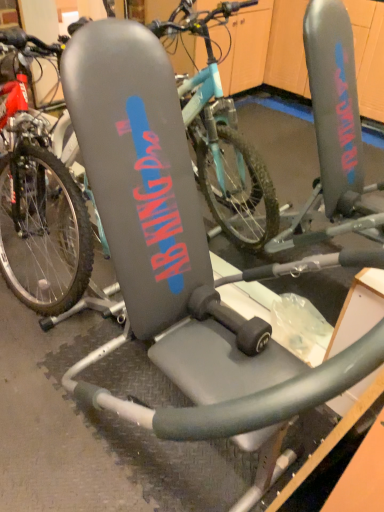
This screenshot has height=512, width=384. What do you see at coordinates (223, 141) in the screenshot?
I see `matte gray exercise machine at center` at bounding box center [223, 141].

In order to face matte gray exercise machine at center, should I rotate leftwards or rightwards?

A 17.950 degree turn to the left will do.

Find the location of a particular element. The image size is (384, 512). matte gray exercise machine at center is located at coordinates (223, 141).

Where is `matte gray exercise machine at center`? The image size is (384, 512). matte gray exercise machine at center is located at coordinates (223, 141).